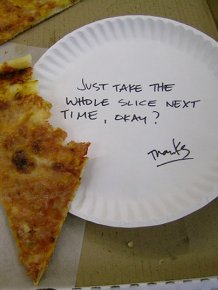
At what (x,y) coordinates should I click in order to perform the action: click on cardboard box. Please return your answer as a coordinate pair (x, y). The height and width of the screenshot is (290, 218). Looking at the image, I should click on (177, 249), (80, 18), (197, 12).